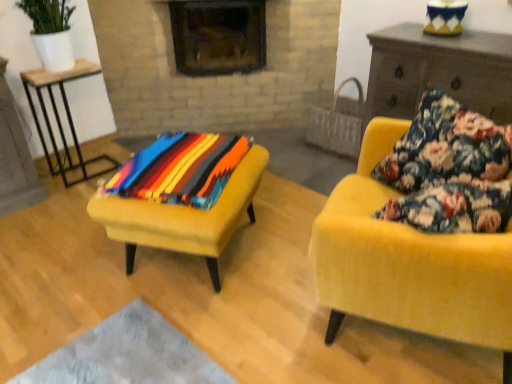
This screenshot has height=384, width=512. I want to click on free spot in front of velvet yellow stool at center, so [157, 340].